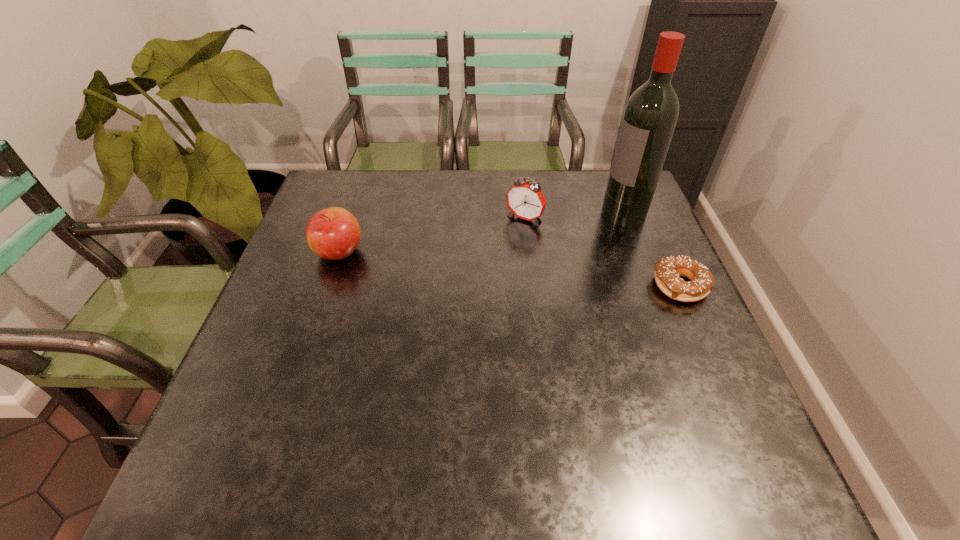
Identify the location of apple. Image resolution: width=960 pixels, height=540 pixels. 333,233.

Locate an element on the screen. This screenshot has height=540, width=960. doughnut is located at coordinates (668, 270).

Image resolution: width=960 pixels, height=540 pixels. What are the coordinates of `wine bottle` in the screenshot? It's located at (649, 120).

Identify the location of alarm clock. click(525, 200).

In order to click on vacant space located on the back of the leftmost object in this screenshot , I will do (x=357, y=198).

This screenshot has width=960, height=540. Identify the location of free space located 0.250m on the front of the shortest object. (732, 403).

Where is `free spot located on the label of the tallest object`? The image size is (960, 540). free spot located on the label of the tallest object is located at coordinates (580, 232).

At what (x,y) coordinates should I click in order to perform the action: click on free space located on the label of the tallest object. Please return your answer as a coordinate pair (x, y). Image resolution: width=960 pixels, height=540 pixels. Looking at the image, I should click on (550, 243).

Locate an element on the screen. This screenshot has height=540, width=960. vacant space located on the label of the tallest object is located at coordinates (514, 258).

You are a GUI agent. You are given a task and a screenshot of the screen. Output one action in this format:
    pyautogui.click(x=<x>, y=<y>)
    Task: Click on the vacant space located 0.350m on the clock face of the third object from right to left
    This screenshot has width=960, height=540.
    Given the screenshot: What is the action you would take?
    pyautogui.click(x=452, y=308)